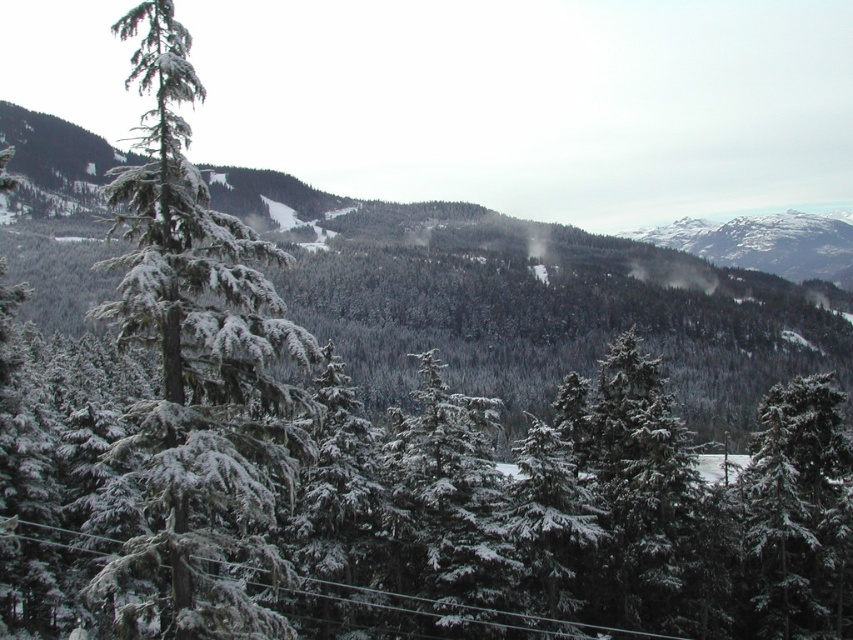
Does point (280, 198) come closer to viewer compared to point (840, 534)?

No, (280, 198) is behind (840, 534).

Does snow-covered evergreen trees at center have a larger size compared to snow-covered evergreen at right?

Indeed, snow-covered evergreen trees at center has a larger size compared to snow-covered evergreen at right.

Is point (782, 349) positioned before point (772, 609)?

No, it is behind (772, 609).

Identify the location of snow-covered evergreen trees at center. (532, 301).

Does point (70, 288) come farther from viewer compared to point (260, 275)?

Yes, it is.

Does snow-covered evergreen trees at center have a lesser height compared to snow-covered evergreen at center?

In fact, snow-covered evergreen trees at center may be taller than snow-covered evergreen at center.

Image resolution: width=853 pixels, height=640 pixels. What do you see at coordinates (532, 301) in the screenshot? I see `snow-covered evergreen trees at center` at bounding box center [532, 301].

This screenshot has height=640, width=853. In order to click on snow-covered evergreen trees at center in this screenshot , I will do `click(532, 301)`.

Looking at this image, who is more forward, [190,188] or [827,557]?

Point [190,188] is more forward.

Is snow-covered evergreen at center taller than snow-covered evergreen at right?

Indeed, snow-covered evergreen at center has a greater height compared to snow-covered evergreen at right.

Who is more forward, (242,323) or (747,592)?

Point (242,323) is in front.

Find the location of `snow-covered evergreen at center`. snow-covered evergreen at center is located at coordinates (196, 371).